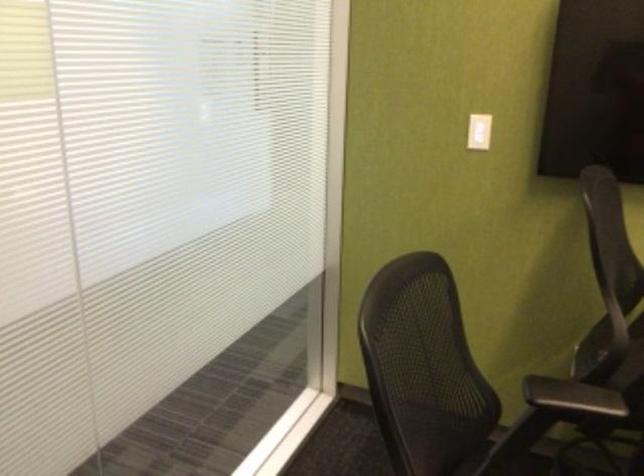
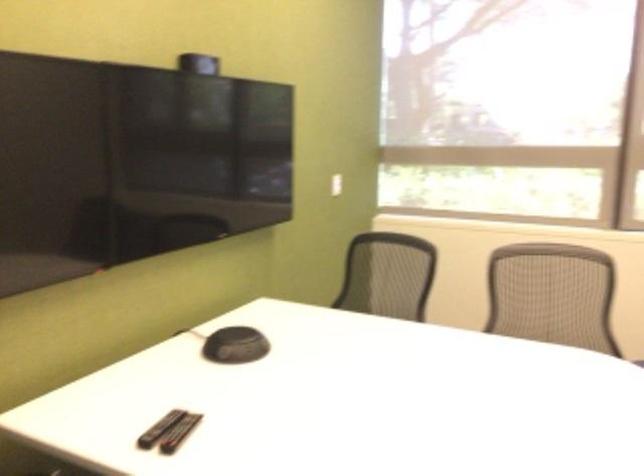
Question: The camera is either moving clockwise (left) or counter-clockwise (right) around the object. The first image is from the beginning of the video and the second image is from the end. Is the camera moving left or right when shooting the video?

Choices:
 (A) Left
 (B) Right

Answer: (A)